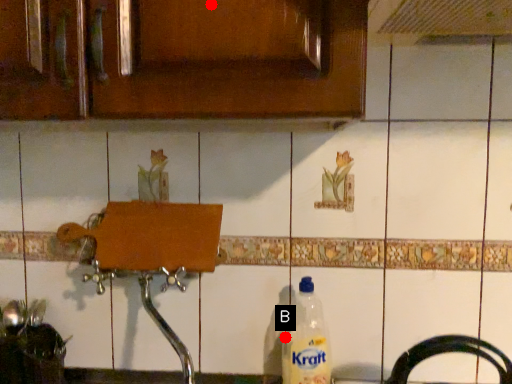
Question: Two points are circled on the image, labeled by A and B beside each circle. Which point is closer to the camera?

Choices:
 (A) A is closer
 (B) B is closer

Answer: (A)